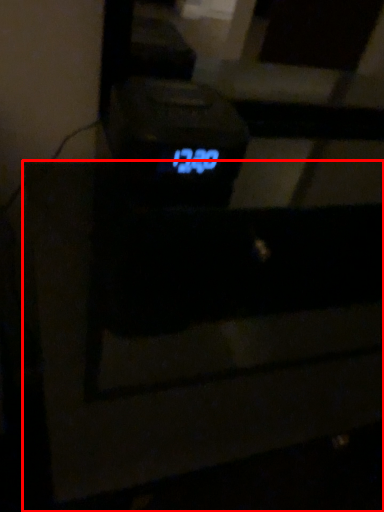
Question: In this image, where is furniture (annotated by the red box) located relative to digital clock?

Choices:
 (A) left
 (B) right

Answer: (B)